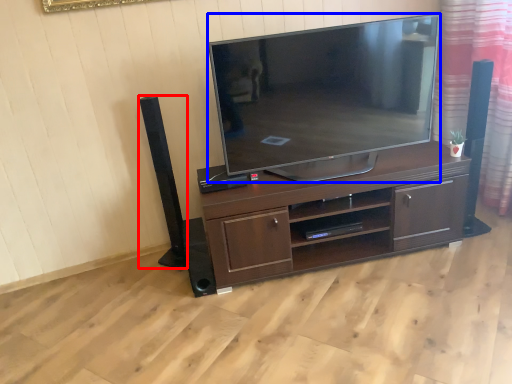
Question: Which of the following is the farthest to the observer, speaker (highlighted by a red box) or television (highlighted by a blue box)?

Choices:
 (A) speaker
 (B) television

Answer: (A)